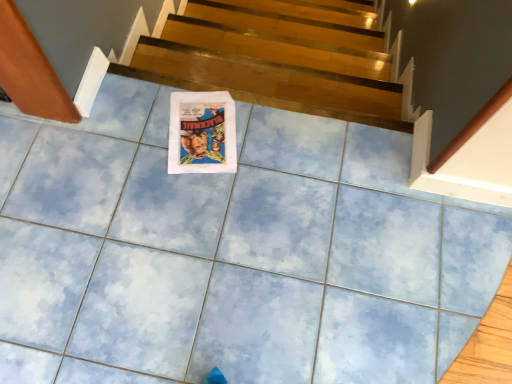
Question: From a real-world perspective, is wooden at upper center located higher than matte paper poster at center?

Choices:
 (A) no
 (B) yes

Answer: (A)

Question: Is matte paper poster at center at the back of wooden at upper center?

Choices:
 (A) yes
 (B) no

Answer: (B)

Question: Is wooden at upper center further to camera compared to matte paper poster at center?

Choices:
 (A) no
 (B) yes

Answer: (B)

Question: Can you confirm if wooden at upper center is wider than matte paper poster at center?

Choices:
 (A) yes
 (B) no

Answer: (B)

Question: Is wooden at upper center not within matte paper poster at center?

Choices:
 (A) no
 (B) yes

Answer: (B)

Question: Does wooden at upper center have a lesser height compared to matte paper poster at center?

Choices:
 (A) no
 (B) yes

Answer: (A)

Question: Is matte paper poster at center shorter than wooden at upper center?

Choices:
 (A) no
 (B) yes

Answer: (B)

Question: From the image's perspective, is matte paper poster at center located beneath wooden at upper center?

Choices:
 (A) yes
 (B) no

Answer: (A)

Question: Can you confirm if matte paper poster at center is smaller than wooden at upper center?

Choices:
 (A) no
 (B) yes

Answer: (B)

Question: Would you say wooden at upper center is part of matte paper poster at center's contents?

Choices:
 (A) yes
 (B) no

Answer: (B)

Question: Does matte paper poster at center appear on the left side of wooden at upper center?

Choices:
 (A) yes
 (B) no

Answer: (A)

Question: From a real-world perspective, is matte paper poster at center on wooden at upper center?

Choices:
 (A) no
 (B) yes

Answer: (B)

Question: Is matte paper poster at center in front of or behind wooden at upper center in the image?

Choices:
 (A) front
 (B) behind

Answer: (A)